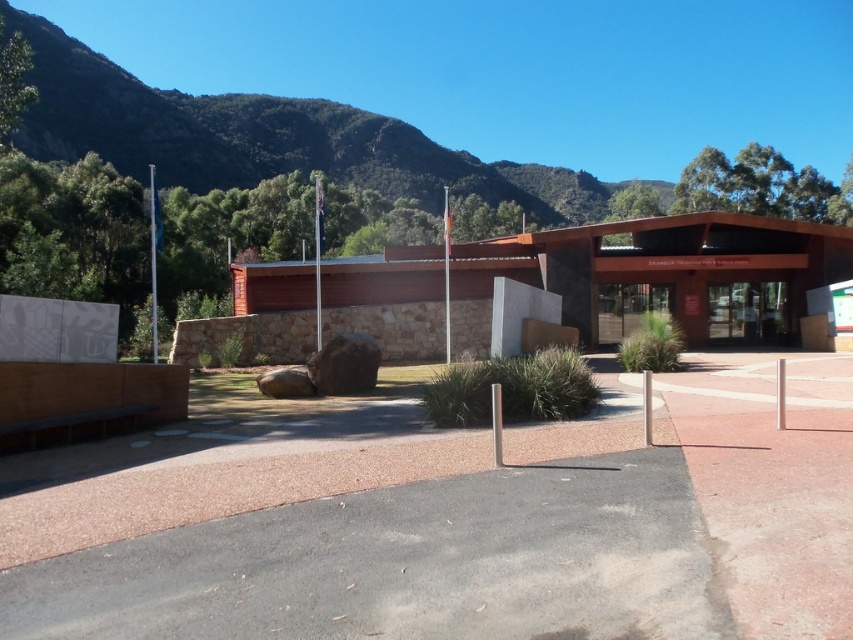
Does green textured rock at upper center appear on the left side of transparent glass door at center?

Yes, green textured rock at upper center is to the left of transparent glass door at center.

Does point (119, 122) come closer to viewer compared to point (654, 285)?

No, (119, 122) is further to viewer.

Is point (27, 138) farther from viewer compared to point (631, 312)?

Yes, it is behind point (631, 312).

Identify the location of green textured rock at upper center. pos(263,138).

Is green textured rock at upper center to the left of transparent glass doors at center from the viewer's perspective?

Yes, green textured rock at upper center is to the left of transparent glass doors at center.

Does point (595, 218) come farther from viewer compared to point (747, 317)?

That is True.

Where is `green textured rock at upper center`? green textured rock at upper center is located at coordinates (263, 138).

Is point (730, 288) in front of point (610, 321)?

No, (730, 288) is behind (610, 321).

Does point (709, 314) come farther from viewer compared to point (654, 301)?

No, (709, 314) is in front of (654, 301).

The image size is (853, 640). Describe the element at coordinates (747, 310) in the screenshot. I see `transparent glass doors at center` at that location.

At what (x,y) coordinates should I click in order to perform the action: click on transparent glass doors at center. Please return your answer as a coordinate pair (x, y). This screenshot has height=640, width=853. Looking at the image, I should click on (747, 310).